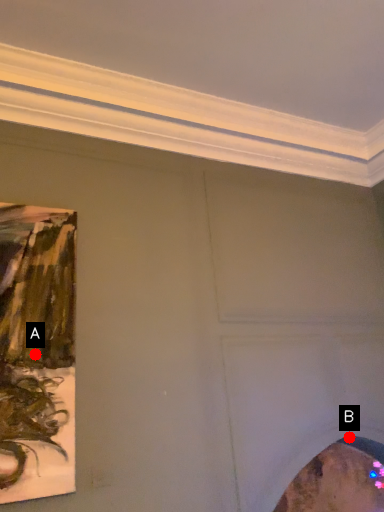
Question: Two points are circled on the image, labeled by A and B beside each circle. Which point is further to the camera?

Choices:
 (A) A is further
 (B) B is further

Answer: (B)